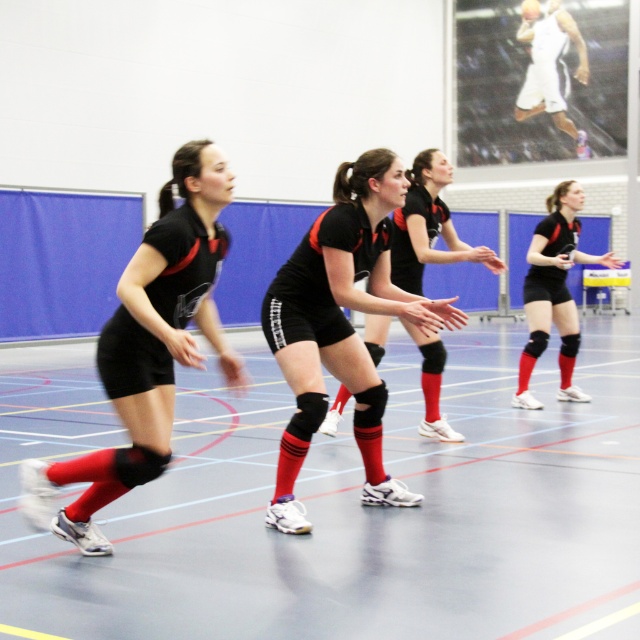
Question: Is matte black uniform at center bigger than black matte shorts at center?

Choices:
 (A) no
 (B) yes

Answer: (A)

Question: Considering the real-world distances, which object is closest to the matte black knee pads at center?

Choices:
 (A) black matte shorts at center
 (B) matte black uniform at center

Answer: (A)

Question: Which of the following is the closest to the observer?

Choices:
 (A) (300, 273)
 (B) (205, 172)

Answer: (B)

Question: Which is nearer to the black matte shorts at center?

Choices:
 (A) matte black uniform at center
 (B) matte black knee pads at center
 (C) matte black shorts at center

Answer: (A)

Question: Can you confirm if matte black uniform at center is wider than matte black knee pads at center?

Choices:
 (A) no
 (B) yes

Answer: (B)

Question: Is black matte shorts at center to the right of matte black shorts at center from the viewer's perspective?

Choices:
 (A) yes
 (B) no

Answer: (B)